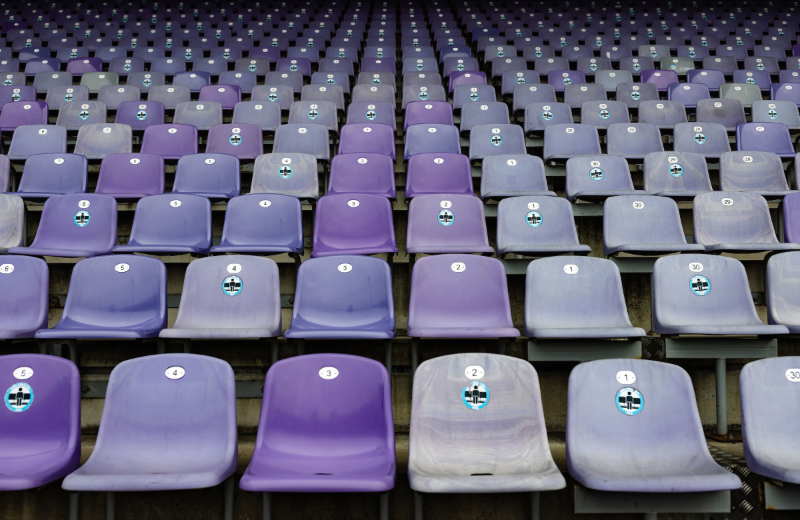
Locate an element on the screen. seat number 2 is located at coordinates (480, 368), (476, 302), (460, 219), (452, 175).